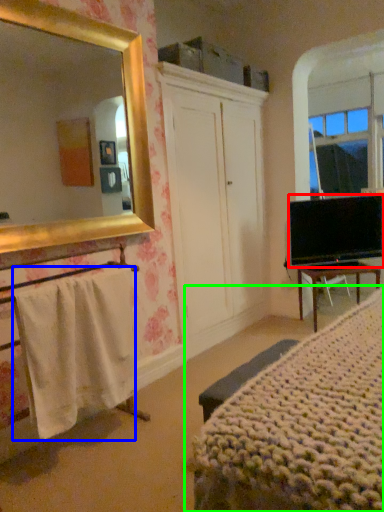
Question: Estimate the real-world distances between objects in this image. Which object is farther from television (highlighted by a red box), towel/napkin (highlighted by a blue box) or bed (highlighted by a green box)?

Choices:
 (A) towel/napkin
 (B) bed

Answer: (A)